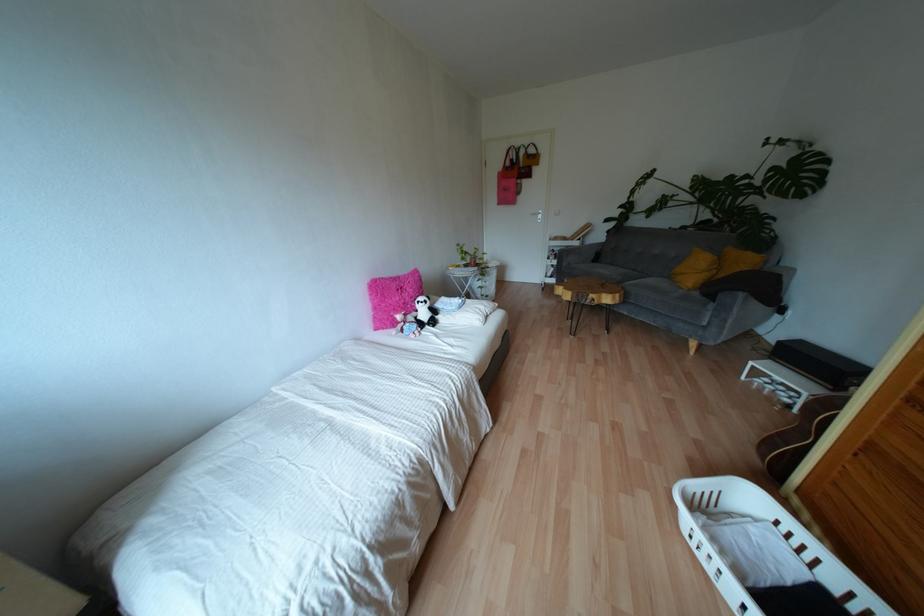
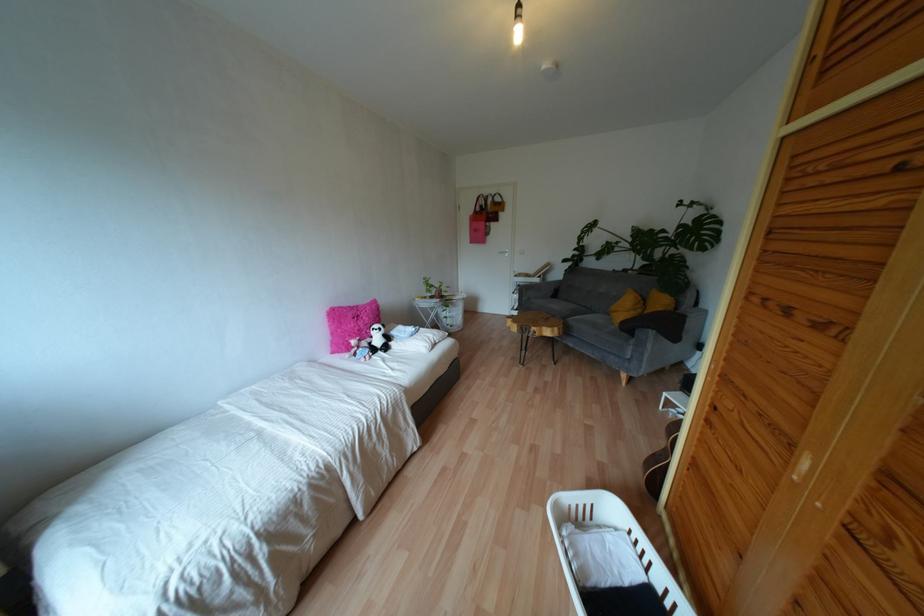
In the second image, find the point that corresponds to (743,261) in the first image.

(660, 302)